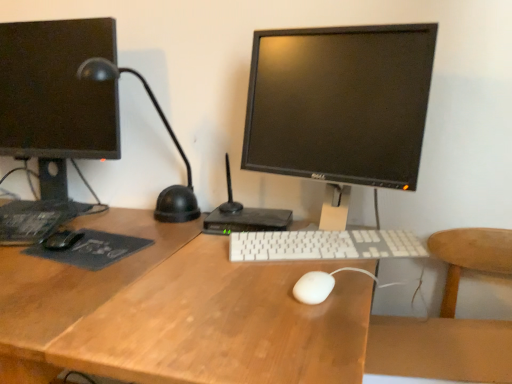
This screenshot has height=384, width=512. I want to click on free space on the front side of dark gray matte mousepad at left, so click(x=64, y=278).